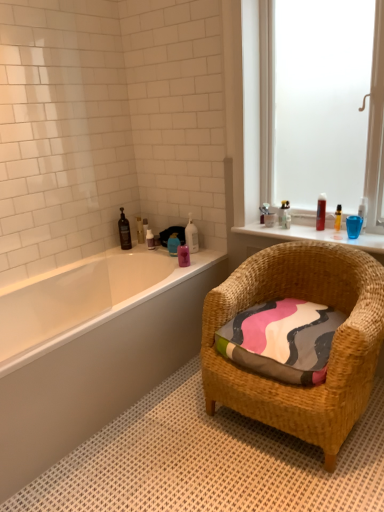
Locate an element on the screen. The width and height of the screenshot is (384, 512). empty space that is ontop of translucent glass bottles at upper right is located at coordinates (308, 231).